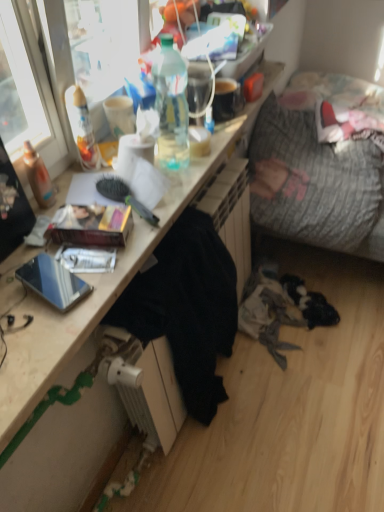
At what (x,y) coordinates should I click in order to perform the action: click on free space on the front side of black fabric at lower center. Please return your answer as a coordinate pair (x, y). Looking at the image, I should click on (240, 469).